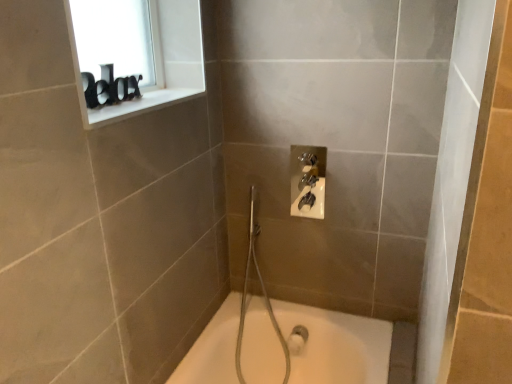
Where is `black plastic letters at upper left`? The image size is (512, 384). black plastic letters at upper left is located at coordinates (118, 39).

The height and width of the screenshot is (384, 512). Describe the element at coordinates (118, 39) in the screenshot. I see `black plastic letters at upper left` at that location.

Image resolution: width=512 pixels, height=384 pixels. Describe the element at coordinates (137, 106) in the screenshot. I see `white ceramic at upper left` at that location.

What are the coordinates of `white ceramic at upper left` in the screenshot? It's located at (137, 106).

What are the coordinates of `black plastic letters at upper left` in the screenshot? It's located at (118, 39).

Considering the positions of objects black plastic letters at upper left and white ceramic at upper left in the image provided, who is more to the left, black plastic letters at upper left or white ceramic at upper left?

Positioned to the left is black plastic letters at upper left.

Which object is further away from the camera taking this photo, black plastic letters at upper left or white ceramic at upper left?

black plastic letters at upper left is further from the camera.

Is point (121, 57) closer to viewer compared to point (127, 109)?

No.

From the image's perspective, is black plastic letters at upper left beneath white ceramic at upper left?

No, from the image's perspective, black plastic letters at upper left is not below white ceramic at upper left.

From a real-world perspective, is black plastic letters at upper left physically above white ceramic at upper left?

Indeed, from a real-world perspective, black plastic letters at upper left stands above white ceramic at upper left.

In the scene shown: Does black plastic letters at upper left have a lesser width compared to white ceramic at upper left?

Correct, the width of black plastic letters at upper left is less than that of white ceramic at upper left.

Considering the relative sizes of black plastic letters at upper left and white ceramic at upper left in the image provided, is black plastic letters at upper left taller than white ceramic at upper left?

Yes.

Who is bigger, black plastic letters at upper left or white ceramic at upper left?

Bigger between the two is black plastic letters at upper left.

Is black plastic letters at upper left completely or partially outside of white ceramic at upper left?

Yes.

Can you see black plastic letters at upper left touching white ceramic at upper left?

No, black plastic letters at upper left is not with white ceramic at upper left.

Is black plastic letters at upper left aimed at white ceramic at upper left?

Yes, black plastic letters at upper left is oriented towards white ceramic at upper left.

How many degrees apart are the facing directions of black plastic letters at upper left and white ceramic at upper left?

The angle between the facing direction of black plastic letters at upper left and the facing direction of white ceramic at upper left is 0.673 degrees.

How much distance is there between black plastic letters at upper left and white ceramic at upper left?

black plastic letters at upper left is 8.12 inches away from white ceramic at upper left.

This screenshot has width=512, height=384. In order to click on window screen above the white ceramic at upper left (from the image's perspective) in this screenshot , I will do `click(118, 39)`.

Does white ceramic at upper left appear on the left side of black plastic letters at upper left?

Incorrect, white ceramic at upper left is not on the left side of black plastic letters at upper left.

Which object is closer to the camera, white ceramic at upper left or black plastic letters at upper left?

white ceramic at upper left is more forward.

Which point is more distant from viewer, (154,103) or (121,66)?

The point (121,66) is farther from the camera.

From the image's perspective, is white ceramic at upper left located beneath black plastic letters at upper left?

Indeed, from the image's perspective, white ceramic at upper left is shown beneath black plastic letters at upper left.

From a real-world perspective, is white ceramic at upper left on black plastic letters at upper left?

No, from a real-world perspective, white ceramic at upper left is not on top of black plastic letters at upper left.

Which of these two, white ceramic at upper left or black plastic letters at upper left, is thinner?

black plastic letters at upper left.

Based on the photo, considering the sizes of white ceramic at upper left and black plastic letters at upper left in the image, is white ceramic at upper left taller or shorter than black plastic letters at upper left?

Clearly, white ceramic at upper left is shorter compared to black plastic letters at upper left.

Who is smaller, white ceramic at upper left or black plastic letters at upper left?

white ceramic at upper left.

Is white ceramic at upper left located outside black plastic letters at upper left?

Absolutely, white ceramic at upper left is external to black plastic letters at upper left.

Is white ceramic at upper left placed right next to black plastic letters at upper left?

white ceramic at upper left is not next to black plastic letters at upper left, and they're not touching.

Is white ceramic at upper left facing away from black plastic letters at upper left?

No, white ceramic at upper left is not facing away from black plastic letters at upper left.

Consider the image. How many degrees apart are the facing directions of white ceramic at upper left and black plastic letters at upper left?

0.673 degrees separate the facing orientations of white ceramic at upper left and black plastic letters at upper left.

The height and width of the screenshot is (384, 512). Find the location of `window screen above the white ceramic at upper left (from the image's perspective)`. window screen above the white ceramic at upper left (from the image's perspective) is located at coordinates (118, 39).

At what (x,y) coordinates should I click in order to perform the action: click on window sill that is in front of the black plastic letters at upper left. Please return your answer as a coordinate pair (x, y). The width and height of the screenshot is (512, 384). Looking at the image, I should click on (137, 106).

Locate an element on the screen. The height and width of the screenshot is (384, 512). window screen located above the white ceramic at upper left (from a real-world perspective) is located at coordinates (118, 39).